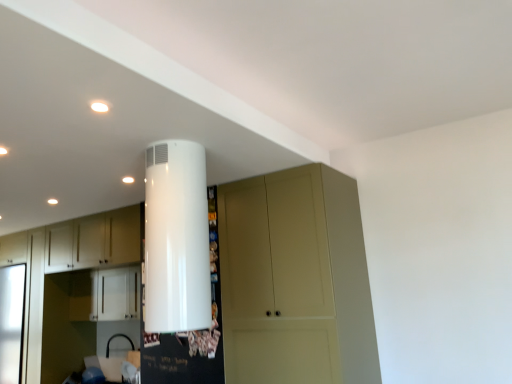
Question: Should I look upward or downward to see white glossy cabinet at center, the 2th cabinetry viewed from the left?

Choices:
 (A) up
 (B) down

Answer: (B)

Question: Is white matte cabinet at left, marked as the second cabinetry in a right-to-left arrangement, a part of white glossy cabinet at center, which is the 1th cabinetry in right-to-left order?

Choices:
 (A) yes
 (B) no

Answer: (B)

Question: Is white matte cabinet at left, the first cabinetry when ordered from left to right, at the back of white glossy cabinet at center, the 2th cabinetry viewed from the left?

Choices:
 (A) yes
 (B) no

Answer: (B)

Question: Is white glossy cabinet at center, which is the 1th cabinetry in right-to-left order, to the right of white matte cabinet at left, marked as the second cabinetry in a right-to-left arrangement, from the viewer's perspective?

Choices:
 (A) no
 (B) yes

Answer: (B)

Question: Is the depth of white glossy cabinet at center, the 2th cabinetry viewed from the left, less than that of white matte cabinet at left, the first cabinetry when ordered from left to right?

Choices:
 (A) no
 (B) yes

Answer: (B)

Question: From a real-world perspective, does white glossy cabinet at center, the 2th cabinetry viewed from the left, sit lower than white matte cabinet at left, the first cabinetry when ordered from left to right?

Choices:
 (A) no
 (B) yes

Answer: (A)

Question: Is white glossy cabinet at center, the 2th cabinetry viewed from the left, outside of white matte cabinet at left, marked as the second cabinetry in a right-to-left arrangement?

Choices:
 (A) yes
 (B) no

Answer: (A)

Question: Does matte beige cupboard at center have a greater width compared to white glossy water heater at upper center?

Choices:
 (A) yes
 (B) no

Answer: (A)

Question: Would you say matte beige cupboard at center is outside white glossy water heater at upper center?

Choices:
 (A) no
 (B) yes

Answer: (B)

Question: From the image's perspective, is matte beige cupboard at center above white glossy water heater at upper center?

Choices:
 (A) yes
 (B) no

Answer: (B)

Question: Is matte beige cupboard at center shorter than white glossy water heater at upper center?

Choices:
 (A) no
 (B) yes

Answer: (A)

Question: Can you confirm if matte beige cupboard at center is positioned to the right of white glossy water heater at upper center?

Choices:
 (A) no
 (B) yes

Answer: (B)

Question: Does matte beige cupboard at center have a lesser width compared to white glossy water heater at upper center?

Choices:
 (A) no
 (B) yes

Answer: (A)

Question: Is white matte cabinet at left, marked as the second cabinetry in a right-to-left arrangement, not near white glossy water heater at upper center?

Choices:
 (A) yes
 (B) no

Answer: (A)